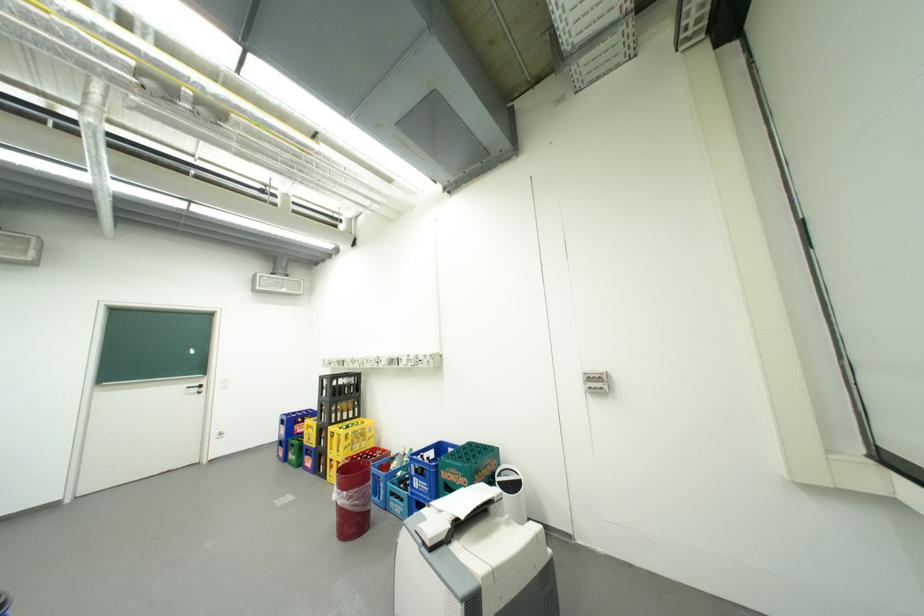
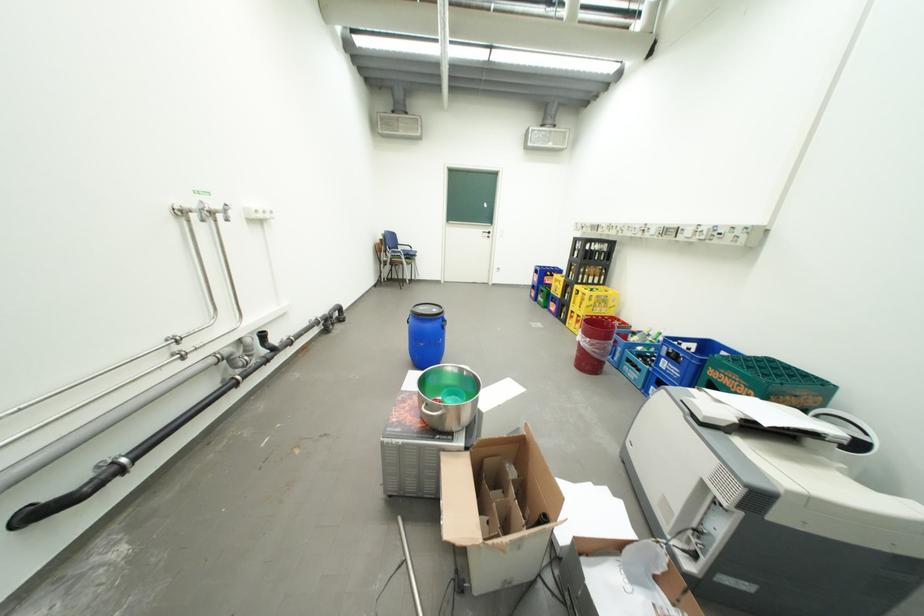
Find the pixel in the second image that matches (x=356, y=493) in the first image.

(599, 341)